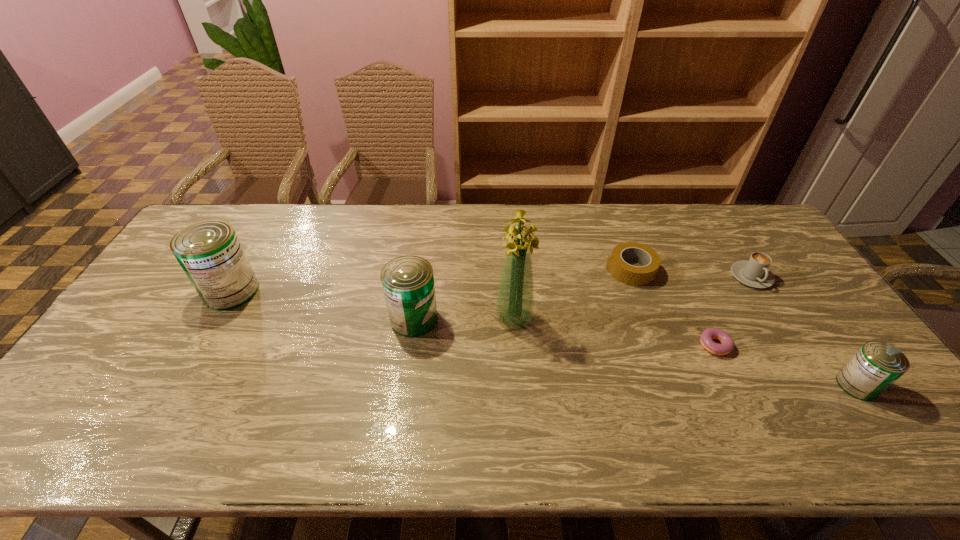
Where is `free space that satisfies the following two spatial constraints: 1. on the front-facing side of the fifth object from left to right; 2. on the left side of the fifth object from right to left`? This screenshot has height=540, width=960. free space that satisfies the following two spatial constraints: 1. on the front-facing side of the fifth object from left to right; 2. on the left side of the fifth object from right to left is located at coordinates (516, 346).

This screenshot has height=540, width=960. What are the coordinates of `vacant point that satisfies the following two spatial constraints: 1. at the edge of the duct tape; 2. on the right side of the shortest object` in the screenshot? It's located at (658, 346).